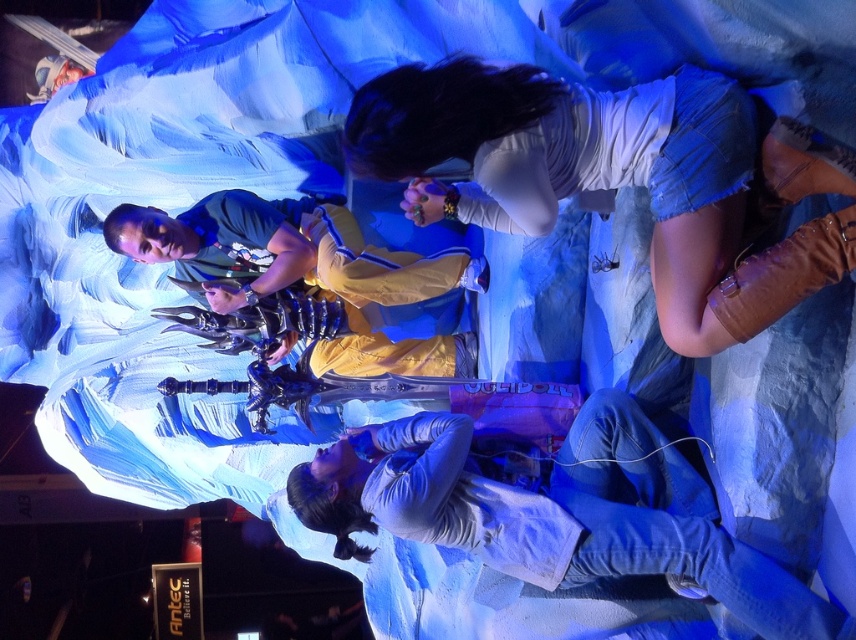
You are a photographer at the event and want to capture a photo of the matte yellow jacket at center while also including the denim shorts at upper right in the frame. Based on their positions, which direction should you move your camera to include both subjects?

The denim shorts at upper right is positioned on the right side of matte yellow jacket at center. To include both subjects in the frame, you should move your camera slightly to the right to ensure both the matte yellow jacket at center and the denim shorts at upper right are captured.

You are at the event and want to take a photo of the central figure holding the sword without any obstructions. You are currently standing at point (337,554). There is another person at point (706,320). Which direction should you move to ensure you have a clear view?

You should move towards point (706,320) because it is in front of point (337,554), so moving towards it would place you in a position where the central figure is between you and the obstruction, ensuring a clear view.

You are standing in the convention hall and want to take a photo of both the point at coordinates (759,554) and the point at (385,266). Which point should you focus on first to ensure both are in clear view?

You should focus on point (759,554) first because it is closer to you than point (385,266), allowing both points to be in clear view when adjusting the camera.